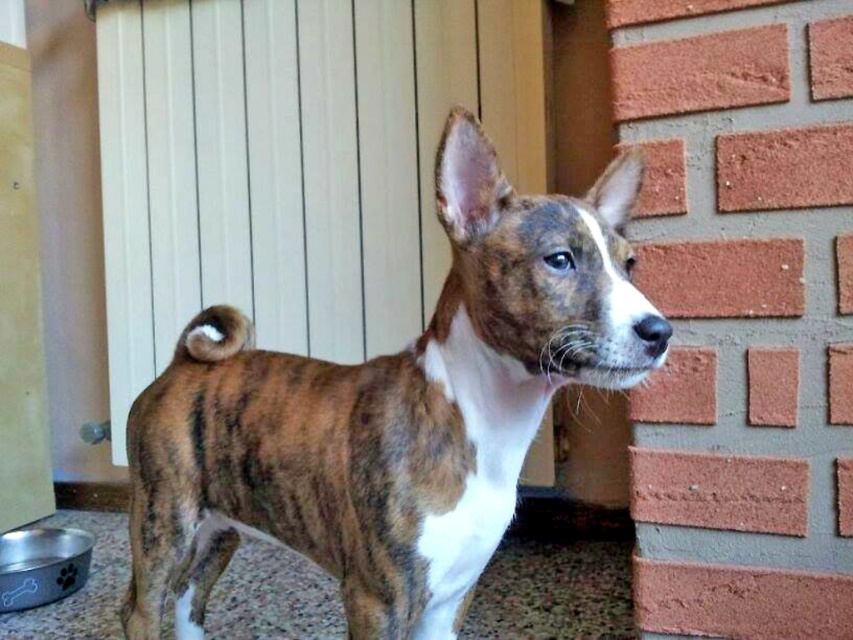
You are a delivery person trying to enter a house. You see the white painted wood door at upper center and the wooden door at left. Which door should you use to enter the house?

The white painted wood door at upper center and wooden door at left are 28.51 inches apart from each other. Since both doors are present, you should use the white painted wood door at upper center as it is typically the main entrance, while the wooden door at left might be a side or interior door.

You are a delivery person who needs to enter the house through the white painted wood door at upper center. However, there is a brown brindle dog at center blocking your path. Can you walk around the dog to reach the door without disturbing it?

The brown brindle dog at center is to the right of the white painted wood door at upper center, so you can walk around the dog to the left side to reach the door without disturbing it.

You are a delivery person trying to enter the house through the wooden door at left. The brown brindle dog at center is blocking your path. Can you pass through the door without moving the dog?

The brown brindle dog at center is larger than the wooden door at left, so it is blocking the entire doorway. You cannot pass through the wooden door at left without moving the dog.